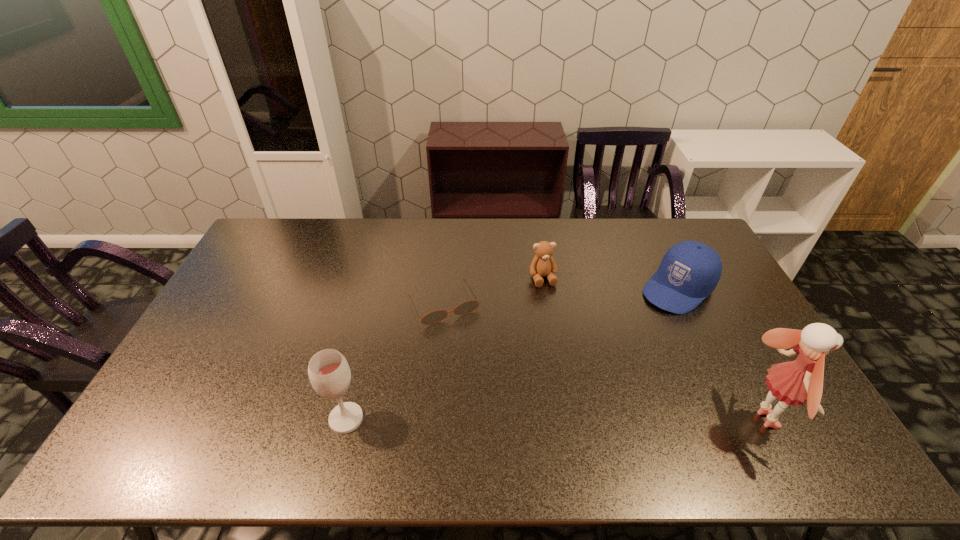
I want to click on vacant space that satisfies the following two spatial constraints: 1. on the front side of the tallest object; 2. on the front-facing side of the shortest object, so click(x=434, y=420).

At what (x,y) coordinates should I click in order to perform the action: click on vacant area that satisfies the following two spatial constraints: 1. on the front side of the cap; 2. on the front-facing side of the doll. Please return your answer as a coordinate pair (x, y). This screenshot has height=540, width=960. Looking at the image, I should click on (741, 420).

At what (x,y) coordinates should I click in order to perform the action: click on vacant region that satisfies the following two spatial constraints: 1. on the front side of the cap; 2. on the front-facing side of the doll. Please return your answer as a coordinate pair (x, y). The image size is (960, 540). Looking at the image, I should click on (741, 420).

Locate an element on the screen. blank space that satisfies the following two spatial constraints: 1. on the front side of the cap; 2. on the front-facing side of the doll is located at coordinates (741, 420).